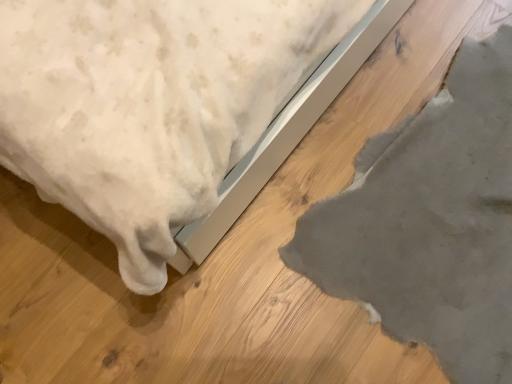
Image resolution: width=512 pixels, height=384 pixels. In order to click on empty space that is ontop of gray matte rug at lower right (from a real-world perspective) in this screenshot , I will do `click(441, 201)`.